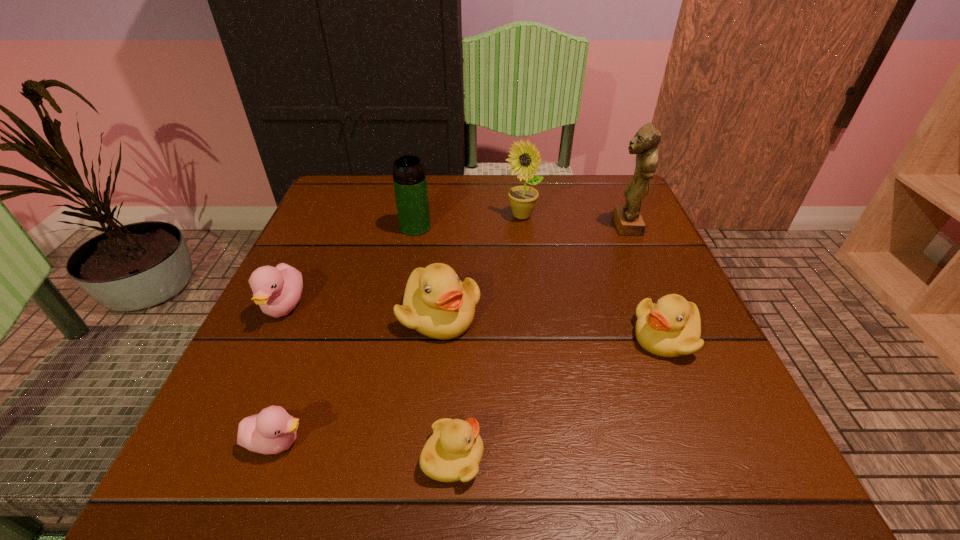
This screenshot has height=540, width=960. I want to click on vacant region that satisfies the following two spatial constraints: 1. on the face of the yellow sunflower; 2. on the front-facing side of the nearest yellow duckling, so click(552, 457).